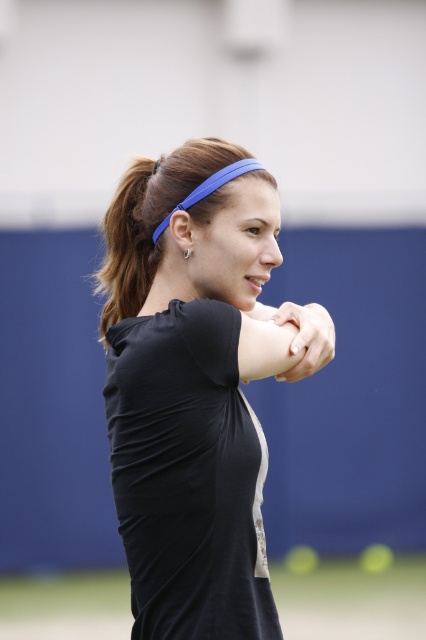
How distant is black matte headband at center from brown hair at upper left?

The distance of black matte headband at center from brown hair at upper left is 12.95 inches.

Between black matte headband at center and brown hair at upper left, which one has more height?

Standing taller between the two is black matte headband at center.

Find the location of a particular element. black matte headband at center is located at coordinates (190, 388).

At what (x,y) coordinates should I click in order to perform the action: click on black matte headband at center. Please return your answer as a coordinate pair (x, y). This screenshot has width=426, height=640. Looking at the image, I should click on [x=190, y=388].

The image size is (426, 640). I want to click on brown hair at upper left, so click(124, 248).

Does point (129, 291) come closer to viewer compared to point (302, 328)?

No, (129, 291) is further to viewer.

Locate an element on the screen. The width and height of the screenshot is (426, 640). brown hair at upper left is located at coordinates (124, 248).

Which is more to the right, black matte headband at center or smooth skin at center?

smooth skin at center is more to the right.

Can you confirm if black matte headband at center is bigger than smooth skin at center?

Indeed, black matte headband at center has a larger size compared to smooth skin at center.

This screenshot has width=426, height=640. Find the location of `black matte headband at center`. black matte headband at center is located at coordinates (190, 388).

Where is `black matte headband at center`? black matte headband at center is located at coordinates (190, 388).